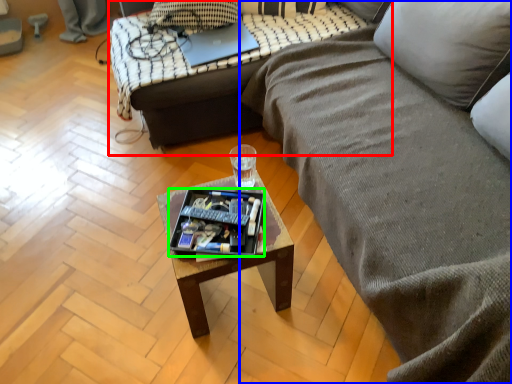
Question: Based on their relative distances, which object is farther from studio couch (highlighted by a red box)? Choose from studio couch (highlighted by a blue box) and tray (highlighted by a green box).

Choices:
 (A) studio couch
 (B) tray

Answer: (B)